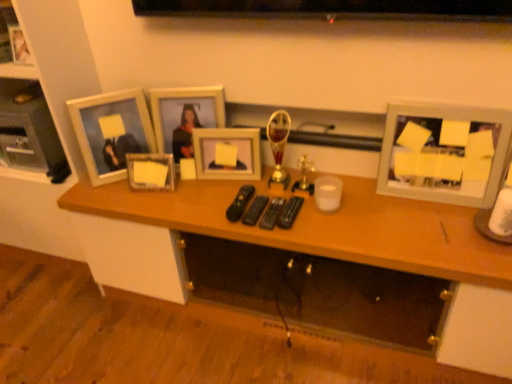
At what (x,y) coordinates should I click in order to perform the action: click on vacant area that lies to the right of black plastic remote control at center, which is the third remote control from left to right. Please return your answer as a coordinate pair (x, y). The height and width of the screenshot is (384, 512). Looking at the image, I should click on (330, 216).